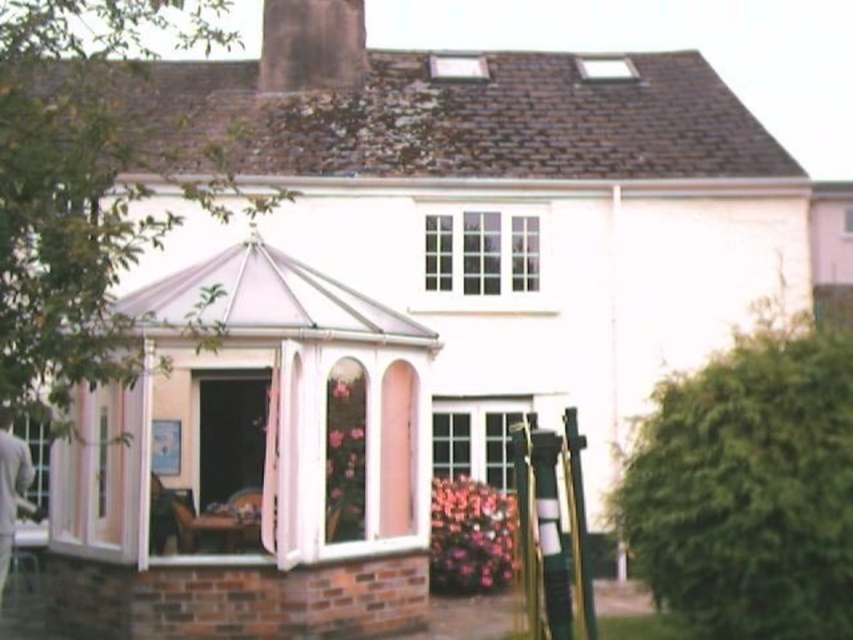
You are standing in the garden of the house and want to enter the conservatory. The conservatory has a door facing the garden. Which object, the pink glass gazebo at left or the dark gray stone chimney at upper center, is closer to the conservatory door?

The pink glass gazebo at left is closer to the conservatory door because it is located below the dark gray stone chimney at upper center, meaning it is positioned lower and nearer to the ground level where the conservatory door is situated.

You are a delivery person trying to deliver a package to the house. The package is too large to fit through the front door of the conservatory. You need to find an alternative entrance. The pink glass gazebo at left and the white glass bay window at upper center are visible from your position. Which entrance is closer to you so you can choose the shortest path?

The pink glass gazebo at left is closer to you than the white glass bay window at upper center because the distance between them is 5.14 meters, so the gazebo entrance is the closer option.

You are a window installer who needs to replace the glass panels of the pink glass gazebo at left and the white glass bay window at upper center. Based on the scene, which object requires taller glass panels for installation?

The pink glass gazebo at left requires taller glass panels because it is much taller than the white glass bay window at upper center.